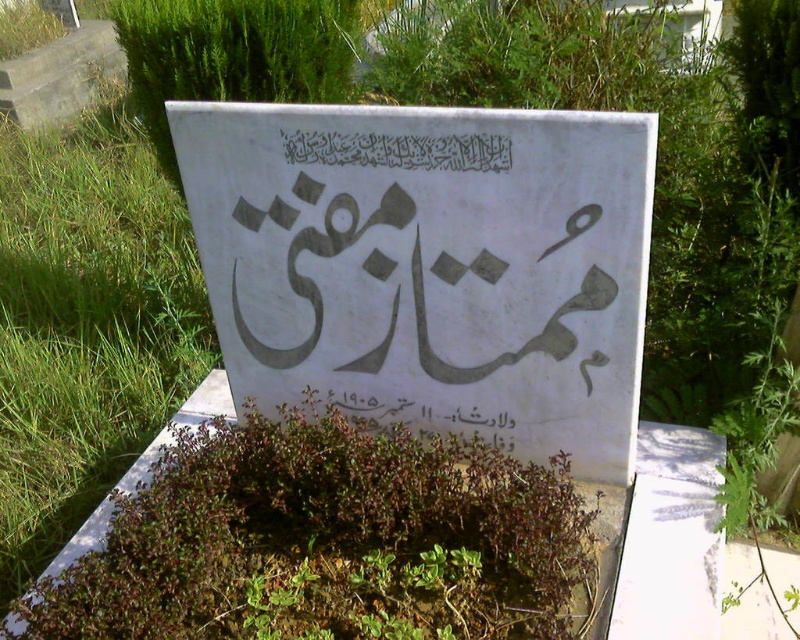
Question: Which object is the closest to the black calligraphy at center?

Choices:
 (A) white paper sign at center
 (B) green leafy plant at center

Answer: (A)

Question: Is green leafy plant at center above black calligraphy at center?

Choices:
 (A) no
 (B) yes

Answer: (A)

Question: Is green leafy plant at center further to the viewer compared to black calligraphy at center?

Choices:
 (A) yes
 (B) no

Answer: (B)

Question: Estimate the real-world distances between objects in this image. Which object is closer to the white paper sign at center?

Choices:
 (A) black calligraphy at center
 (B) green leafy plant at center

Answer: (A)

Question: Which object is farther from the camera taking this photo?

Choices:
 (A) green grass at lower left
 (B) white paper sign at center
 (C) black calligraphy at center
 (D) green leafy plant at center

Answer: (A)

Question: Is white paper sign at center bigger than green leafy plant at center?

Choices:
 (A) no
 (B) yes

Answer: (B)